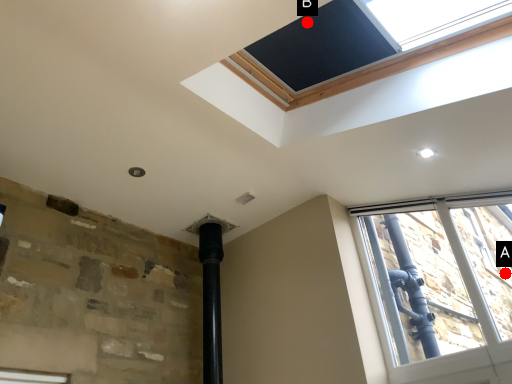
Question: Two points are circled on the image, labeled by A and B beside each circle. Which point is farther to the camera?

Choices:
 (A) A is further
 (B) B is further

Answer: (A)